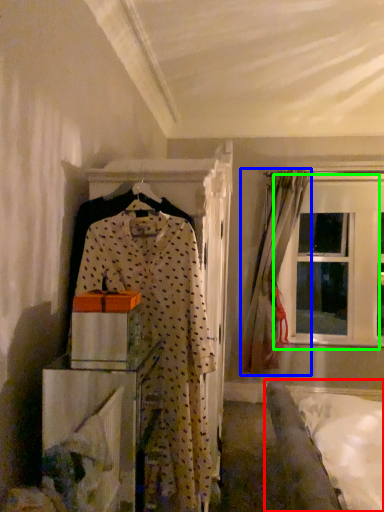
Question: Based on their relative distances, which object is nearer to bed (highlighted by a red box)? Choose from curtain (highlighted by a blue box) and window (highlighted by a green box).

Choices:
 (A) curtain
 (B) window

Answer: (A)